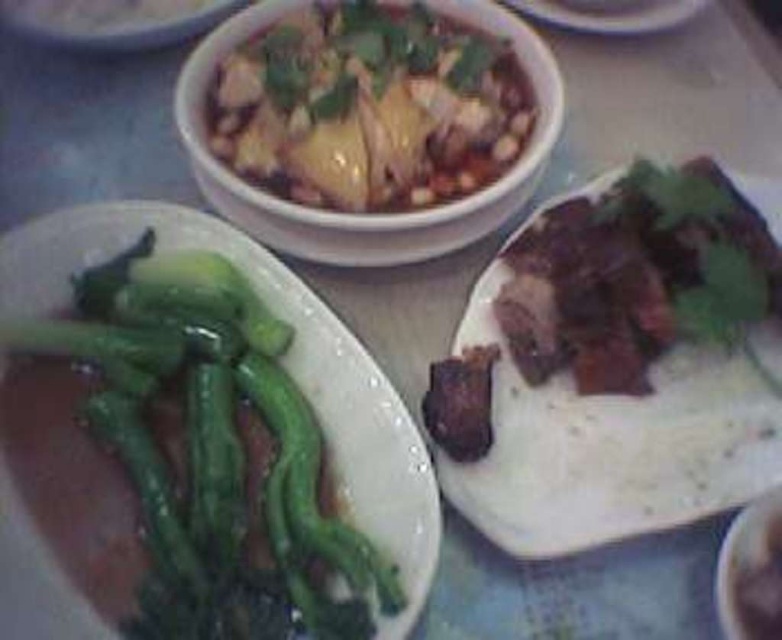
You are a food critic sitting at the table. You want to reach for the green glossy vegetables at left and the brown crispy meat at center. Which one is closer to you?

The green glossy vegetables at left is closer to you because it is in front of the brown crispy meat at center.

You are a food critic evaluating the table setting. You notice the brown crispy meat at center and the white ceramic plate at upper center. Which item has a greater height?

The brown crispy meat at center is much taller than the white ceramic plate at upper center.